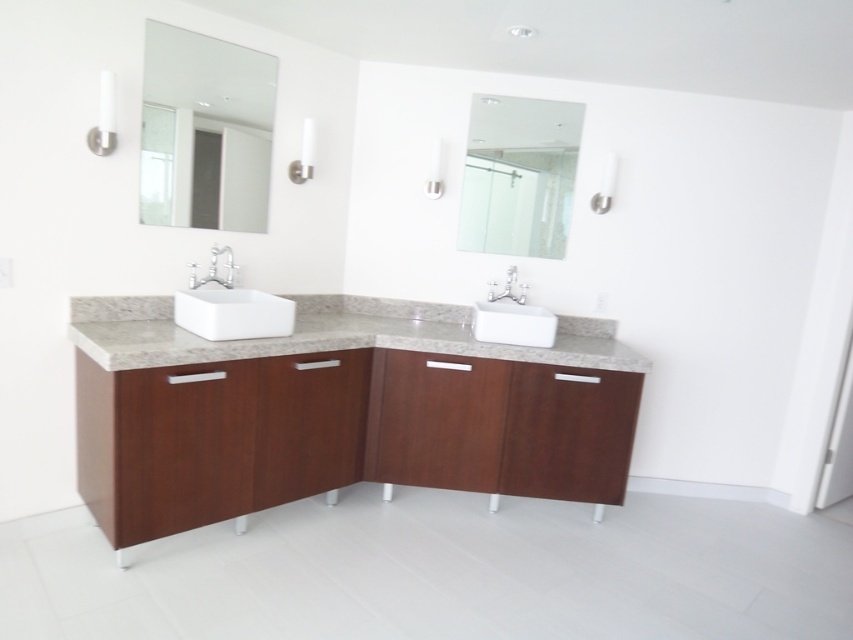
Does gray granite countertop at center have a smaller size compared to clear glass mirror at upper center?

Incorrect, gray granite countertop at center is not smaller in size than clear glass mirror at upper center.

From the picture: How much distance is there between gray granite countertop at center and clear glass mirror at upper center?

77.17 centimeters

What are the coordinates of `gray granite countertop at center` in the screenshot? It's located at (328, 333).

You are a GUI agent. You are given a task and a screenshot of the screen. Output one action in this format:
    pyautogui.click(x=<x>, y=<y>)
    Task: Click on the gray granite countertop at center
    The width and height of the screenshot is (853, 640).
    Given the screenshot: What is the action you would take?
    pyautogui.click(x=328, y=333)

How far apart are gray granite countertop at center and white glossy faucet at upper left?

They are 21.81 inches apart.

Between gray granite countertop at center and white glossy faucet at upper left, which one appears on the left side from the viewer's perspective?

white glossy faucet at upper left is more to the left.

Where is `gray granite countertop at center`? The width and height of the screenshot is (853, 640). gray granite countertop at center is located at coordinates (328, 333).

Locate an element on the screen. The width and height of the screenshot is (853, 640). gray granite countertop at center is located at coordinates (328, 333).

Between white ceramic sink at center and white glossy faucet at upper left, which one is positioned higher?

Positioned higher is white glossy faucet at upper left.

Can you confirm if white ceramic sink at center is positioned below white glossy faucet at upper left?

Correct, white ceramic sink at center is located below white glossy faucet at upper left.

At what (x,y) coordinates should I click in order to perform the action: click on white ceramic sink at center. Please return your answer as a coordinate pair (x, y). The height and width of the screenshot is (640, 853). Looking at the image, I should click on (512, 317).